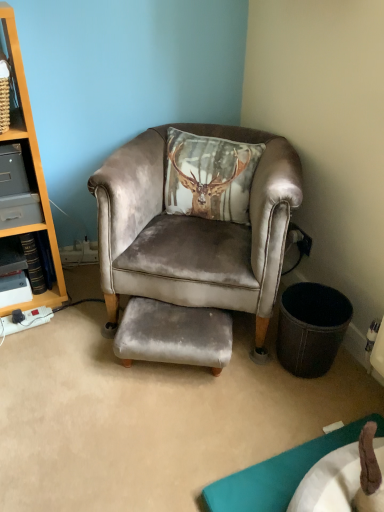
Identify the location of vacant space that is to the left of velvet grey footrest at center. Image resolution: width=384 pixels, height=512 pixels. (87, 360).